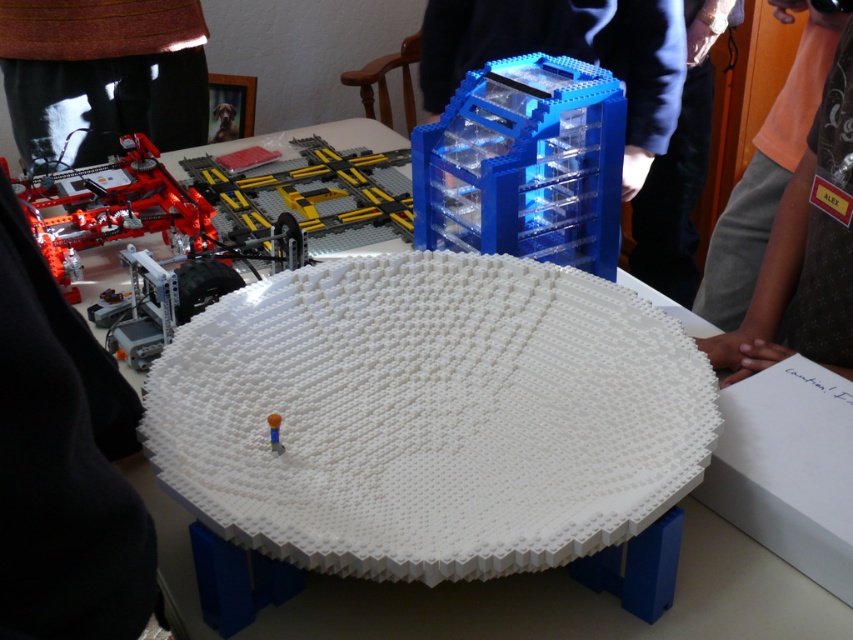
Is the position of white plastic plate at center less distant than that of matte black monitor at upper left?

Yes, white plastic plate at center is closer to the viewer.

The image size is (853, 640). Describe the element at coordinates (428, 416) in the screenshot. I see `white plastic plate at center` at that location.

Which is in front, point (281, 390) or point (51, 60)?

Positioned in front is point (281, 390).

Locate an element on the screen. The height and width of the screenshot is (640, 853). white plastic plate at center is located at coordinates (428, 416).

Which is more to the right, transparent blue cube at center or translucent plastic stick at center?

From the viewer's perspective, transparent blue cube at center appears more on the right side.

How much distance is there between transparent blue cube at center and translucent plastic stick at center?

The distance of transparent blue cube at center from translucent plastic stick at center is 23.44 inches.

The width and height of the screenshot is (853, 640). Identify the location of transparent blue cube at center. pyautogui.click(x=524, y=164).

Does matte black monitor at upper left have a greater height compared to gray fabric shirt at upper right?

No, matte black monitor at upper left is not taller than gray fabric shirt at upper right.

Is point (165, 35) positioned in front of point (657, 227)?

Yes, it is in front of point (657, 227).

I want to click on matte black monitor at upper left, so [x=102, y=74].